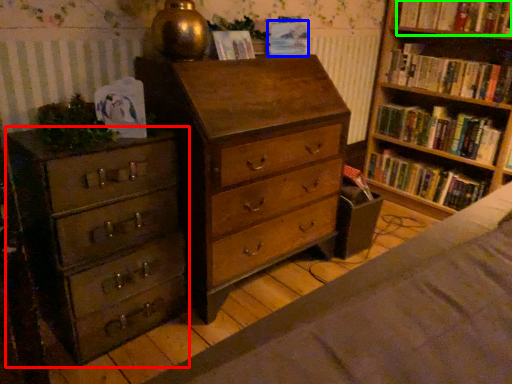
Question: Estimate the real-world distances between objects in this image. Which object is farther from chest of drawers (highlighted by a red box), paperback book (highlighted by a blue box) or book (highlighted by a green box)?

Choices:
 (A) paperback book
 (B) book

Answer: (B)